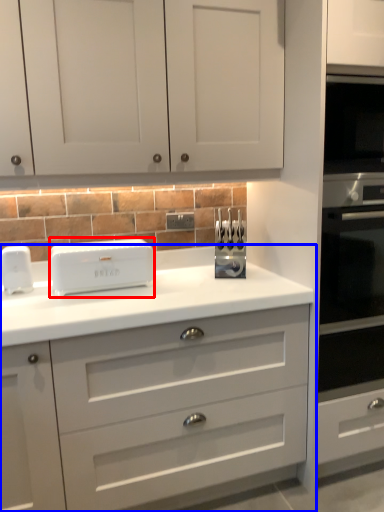
Question: Which object appears closest to the camera in this image, home appliance (highlighted by a red box) or chest of drawers (highlighted by a blue box)?

Choices:
 (A) home appliance
 (B) chest of drawers

Answer: (B)